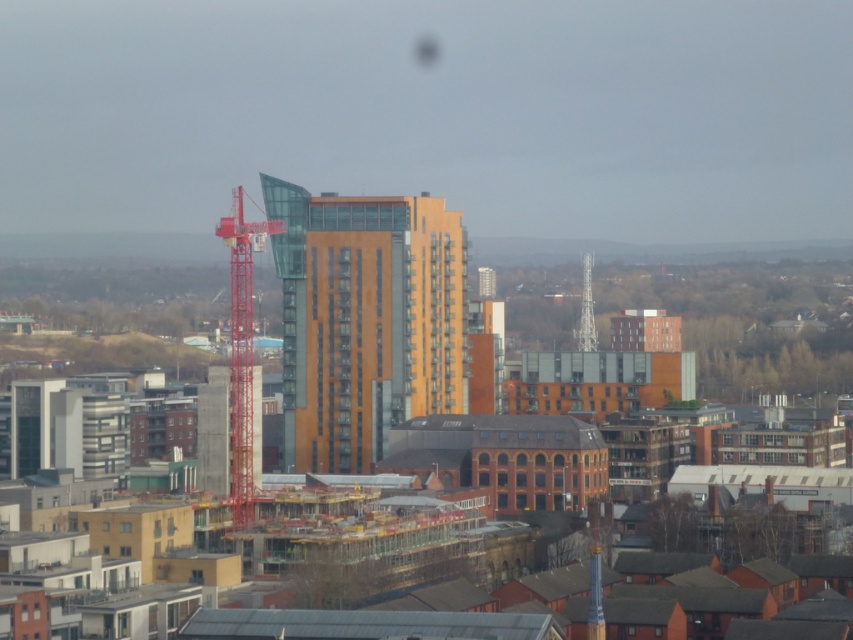
Question: Can you confirm if orange glass building at center is positioned below metallic silver tower at center?

Choices:
 (A) yes
 (B) no

Answer: (A)

Question: Which of the following is the farthest from the observer?

Choices:
 (A) (592, 342)
 (B) (451, 381)
 (C) (242, 387)

Answer: (A)

Question: Which is farther from the red metal crane at left?

Choices:
 (A) metallic silver tower at center
 (B) orange glass building at center

Answer: (A)

Question: Does orange glass building at center appear on the left side of metallic silver tower at center?

Choices:
 (A) yes
 (B) no

Answer: (A)

Question: Can you confirm if orange glass building at center is wider than metallic silver tower at center?

Choices:
 (A) yes
 (B) no

Answer: (A)

Question: Which point is closer to the camera?

Choices:
 (A) red metal crane at left
 (B) metallic silver tower at center
 (C) orange glass building at center

Answer: (C)